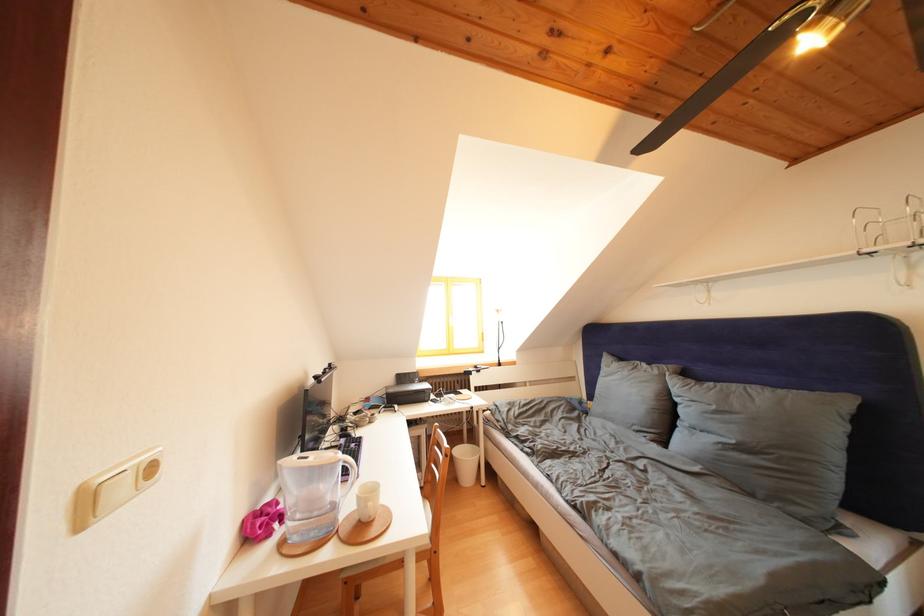
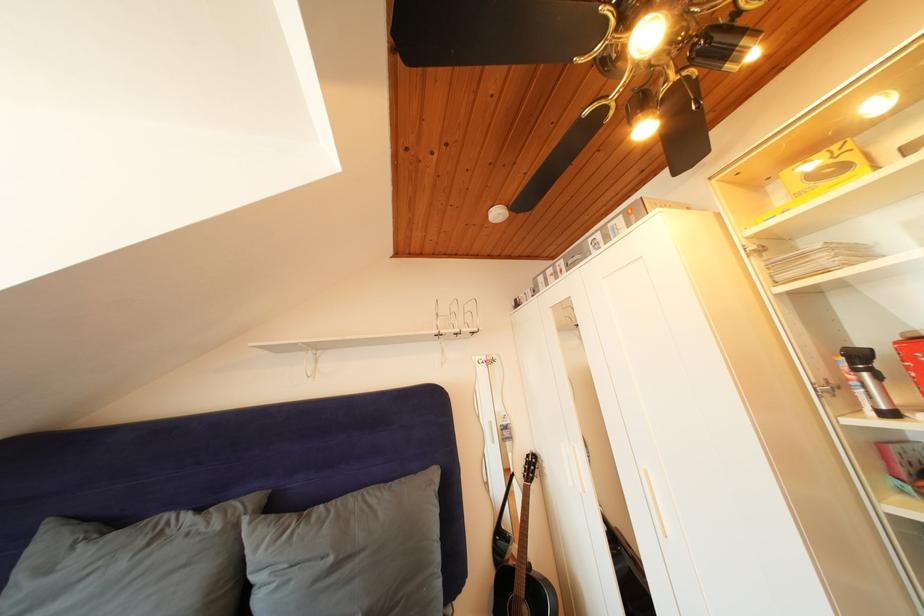
In the second image, find the point that corresponds to (x=663, y=377) in the first image.

(225, 531)